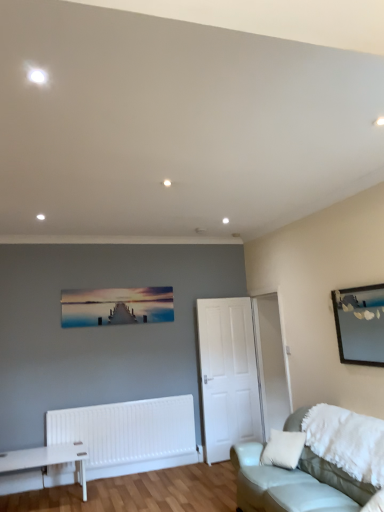
Question: Is wooden mirror at upper right, the 2th picture frame from the back, completely or partially outside of white matte door at center?

Choices:
 (A) no
 (B) yes

Answer: (B)

Question: Is wooden mirror at upper right, the 2th picture frame from the back, wider than white matte door at center?

Choices:
 (A) no
 (B) yes

Answer: (A)

Question: Is wooden mirror at upper right, arranged as the first picture frame when viewed from the front, beside white matte door at center?

Choices:
 (A) yes
 (B) no

Answer: (B)

Question: Considering the relative sizes of wooden mirror at upper right, arranged as the first picture frame when viewed from the front, and white matte door at center in the image provided, is wooden mirror at upper right, arranged as the first picture frame when viewed from the front, thinner than white matte door at center?

Choices:
 (A) no
 (B) yes

Answer: (B)

Question: Can you confirm if wooden mirror at upper right, the 2th picture frame from the back, is bigger than white matte door at center?

Choices:
 (A) no
 (B) yes

Answer: (A)

Question: Looking at the image, does white matte door at center seem bigger or smaller compared to matte wooden pier at center, the 2th picture frame from the front?

Choices:
 (A) big
 (B) small

Answer: (A)

Question: Does point (253, 390) appear closer or farther from the camera than point (147, 309)?

Choices:
 (A) farther
 (B) closer

Answer: (A)

Question: In the image, is white matte door at center positioned in front of or behind matte wooden pier at center, the 2th picture frame from the front?

Choices:
 (A) front
 (B) behind

Answer: (B)

Question: From a real-world perspective, is white matte door at center physically located above or below matte wooden pier at center, placed as the 1th picture frame when sorted from left to right?

Choices:
 (A) above
 (B) below

Answer: (B)

Question: From the image's perspective, is leather couch at lower right positioned above or below white matte door at center?

Choices:
 (A) above
 (B) below

Answer: (B)

Question: Considering the positions of leather couch at lower right and white matte door at center in the image, is leather couch at lower right taller or shorter than white matte door at center?

Choices:
 (A) tall
 (B) short

Answer: (B)

Question: Considering the positions of leather couch at lower right and white matte door at center in the image, is leather couch at lower right wider or thinner than white matte door at center?

Choices:
 (A) wide
 (B) thin

Answer: (A)

Question: From a real-world perspective, relative to white matte door at center, is leather couch at lower right vertically above or below?

Choices:
 (A) above
 (B) below

Answer: (B)

Question: Is wooden mirror at upper right, the first picture frame positioned from the right, in front of or behind matte wooden pier at center, placed as the 1th picture frame when sorted from left to right, in the image?

Choices:
 (A) behind
 (B) front

Answer: (B)

Question: From a real-world perspective, is wooden mirror at upper right, the first picture frame positioned from the right, above or below matte wooden pier at center, the 2th picture frame from the front?

Choices:
 (A) above
 (B) below

Answer: (B)